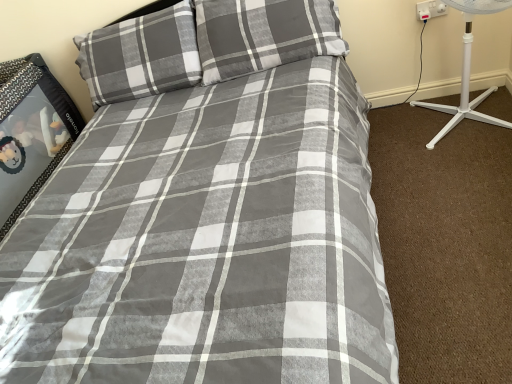
Question: Is gray plaid pillow at upper left, the first pillow in the left-to-right sequence, further to camera compared to gray cotton pillow at upper center, the 1th pillow viewed from the right?

Choices:
 (A) yes
 (B) no

Answer: (A)

Question: Considering the relative sizes of gray plaid pillow at upper left, the first pillow in the left-to-right sequence, and gray cotton pillow at upper center, the 1th pillow viewed from the right, in the image provided, is gray plaid pillow at upper left, the first pillow in the left-to-right sequence, taller than gray cotton pillow at upper center, the 1th pillow viewed from the right,?

Choices:
 (A) yes
 (B) no

Answer: (A)

Question: From a real-world perspective, is gray plaid pillow at upper left, the second pillow when ordered from right to left, positioned over gray cotton pillow at upper center, arranged as the second pillow when viewed from the left, based on gravity?

Choices:
 (A) no
 (B) yes

Answer: (A)

Question: Would you say gray plaid pillow at upper left, the second pillow when ordered from right to left, is outside gray cotton pillow at upper center, the 1th pillow viewed from the right?

Choices:
 (A) yes
 (B) no

Answer: (A)

Question: Is gray cotton pillow at upper center, arranged as the second pillow when viewed from the left, inside or outside of gray plaid pillow at upper left, the first pillow in the left-to-right sequence?

Choices:
 (A) outside
 (B) inside

Answer: (A)

Question: Considering the positions of gray cotton pillow at upper center, arranged as the second pillow when viewed from the left, and gray plaid pillow at upper left, the first pillow in the left-to-right sequence, in the image, is gray cotton pillow at upper center, arranged as the second pillow when viewed from the left, bigger or smaller than gray plaid pillow at upper left, the first pillow in the left-to-right sequence,?

Choices:
 (A) big
 (B) small

Answer: (B)

Question: Considering the positions of gray cotton pillow at upper center, the 1th pillow viewed from the right, and gray plaid pillow at upper left, the second pillow when ordered from right to left, in the image, is gray cotton pillow at upper center, the 1th pillow viewed from the right, wider or thinner than gray plaid pillow at upper left, the second pillow when ordered from right to left,?

Choices:
 (A) thin
 (B) wide

Answer: (A)

Question: From the image's perspective, is gray cotton pillow at upper center, the 1th pillow viewed from the right, positioned above or below gray plaid pillow at upper left, the first pillow in the left-to-right sequence?

Choices:
 (A) above
 (B) below

Answer: (A)

Question: Is gray plaid pillow at upper left, the first pillow in the left-to-right sequence, bigger or smaller than white plastic socket at upper right?

Choices:
 (A) small
 (B) big

Answer: (B)

Question: Is gray plaid pillow at upper left, the second pillow when ordered from right to left, spatially inside white plastic socket at upper right, or outside of it?

Choices:
 (A) inside
 (B) outside

Answer: (B)

Question: Is point (99, 36) closer or farther from the camera than point (441, 8)?

Choices:
 (A) closer
 (B) farther

Answer: (B)

Question: In the image, is gray plaid pillow at upper left, the second pillow when ordered from right to left, positioned in front of or behind white plastic socket at upper right?

Choices:
 (A) front
 (B) behind

Answer: (A)

Question: From their relative heights in the image, would you say white plastic socket at upper right is taller or shorter than gray cotton pillow at upper center, arranged as the second pillow when viewed from the left?

Choices:
 (A) short
 (B) tall

Answer: (A)

Question: Choose the correct answer: Is white plastic socket at upper right inside gray cotton pillow at upper center, the 1th pillow viewed from the right, or outside it?

Choices:
 (A) outside
 (B) inside

Answer: (A)